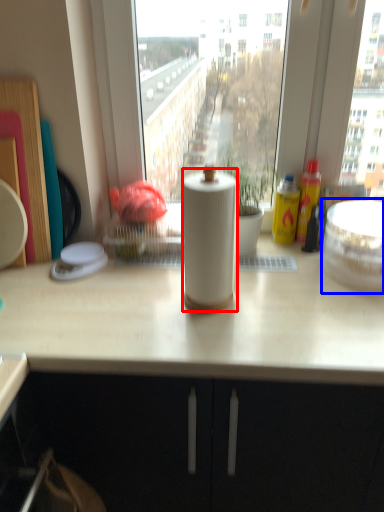
Question: Which of the following is the farthest to the observer, paper towel (highlighted by a red box) or appliance (highlighted by a blue box)?

Choices:
 (A) paper towel
 (B) appliance

Answer: (B)